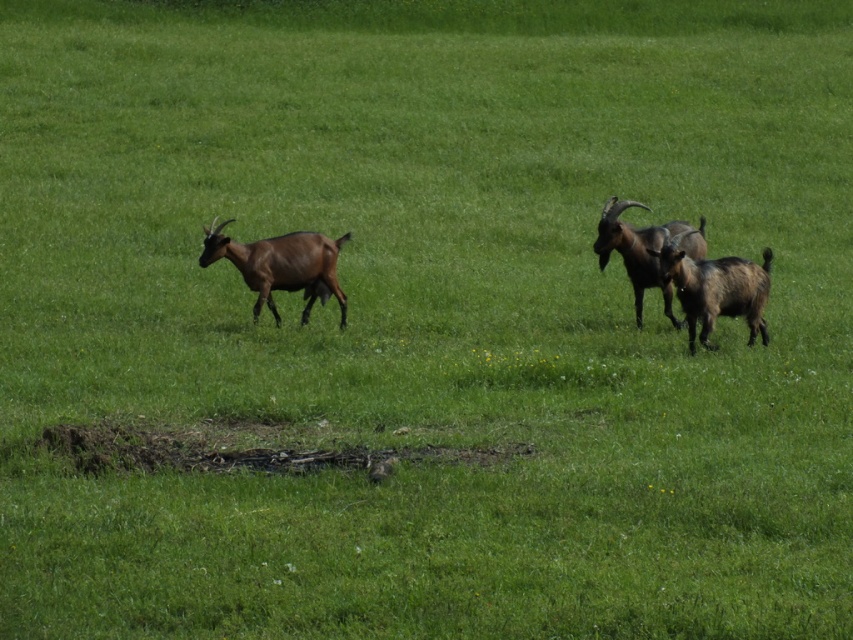
Does brown fuzzy goat at center-right have a larger size compared to brown furry goat at center-right?

No, brown fuzzy goat at center-right is not bigger than brown furry goat at center-right.

Is point (674, 240) positioned before point (664, 296)?

That is True.

The image size is (853, 640). In order to click on brown fuzzy goat at center-right in this screenshot , I will do `click(717, 289)`.

Does brown woolen goat at left appear on the right side of brown fuzzy goat at center-right?

In fact, brown woolen goat at left is to the left of brown fuzzy goat at center-right.

Is brown woolen goat at left below brown fuzzy goat at center-right?

No.

Is point (260, 248) positioned after point (740, 307)?

Yes, it is behind point (740, 307).

Find the location of a particular element. brown woolen goat at left is located at coordinates (281, 266).

Who is lower down, brown woolen goat at left or brown furry goat at center-right?

brown woolen goat at left

Does brown woolen goat at left appear on the left side of brown furry goat at center-right?

Yes, brown woolen goat at left is to the left of brown furry goat at center-right.

You are a GUI agent. You are given a task and a screenshot of the screen. Output one action in this format:
    pyautogui.click(x=<x>, y=<y>)
    Task: Click on the brown woolen goat at left
    Image resolution: width=853 pixels, height=640 pixels.
    Given the screenshot: What is the action you would take?
    281,266